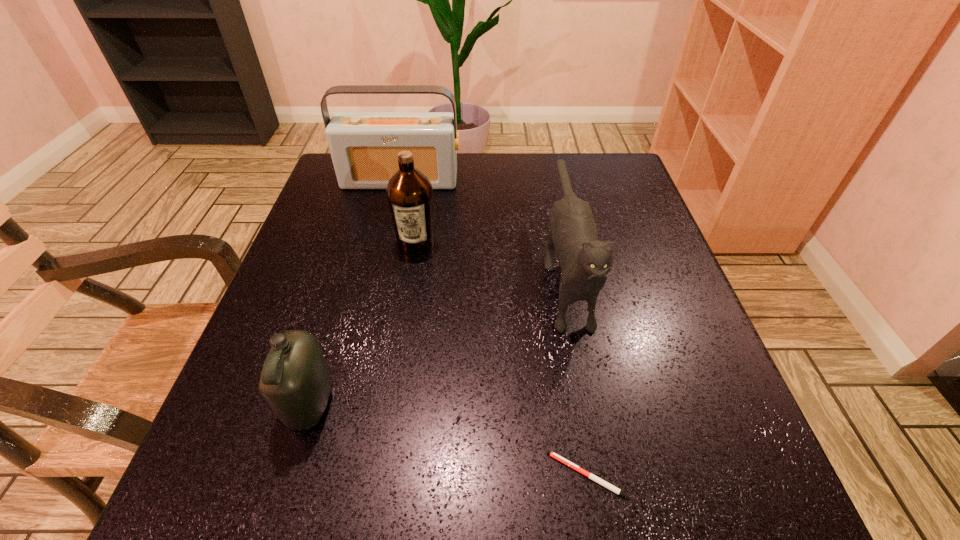
Find the location of `the farthest object`. the farthest object is located at coordinates (364, 146).

Locate an element on the screen. cat is located at coordinates (585, 261).

Where is `olive oil`? This screenshot has width=960, height=540. olive oil is located at coordinates (409, 192).

The image size is (960, 540). I want to click on the second shortest object, so click(295, 381).

Locate an element on the screen. This screenshot has height=540, width=960. bottle is located at coordinates (295, 381).

In order to click on the shortest object in this screenshot , I will do `click(600, 481)`.

Find the location of `the nearest object`. the nearest object is located at coordinates (600, 481).

Where is `vacant area situated on the front-facing side of the farthest object`? This screenshot has height=540, width=960. vacant area situated on the front-facing side of the farthest object is located at coordinates (389, 231).

I want to click on vacant space located 0.190m on the front-facing side of the cat, so click(x=601, y=462).

Identify the location of vacant space located on the label of the olive oil. (400, 344).